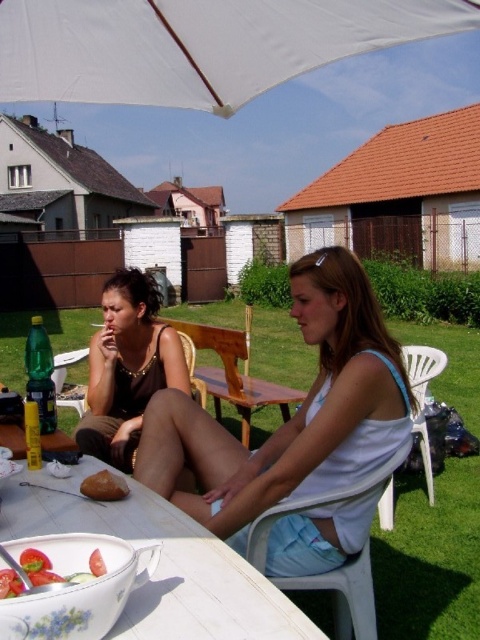
Between white fabric umbrella at upper center and tomato salad at center, which one has less height?

With less height is tomato salad at center.

Is white fabric umbrella at upper center thinner than tomato salad at center?

No.

The width and height of the screenshot is (480, 640). Identify the location of white fabric umbrella at upper center. (197, 45).

What do you see at coordinates (197, 45) in the screenshot? The width and height of the screenshot is (480, 640). I see `white fabric umbrella at upper center` at bounding box center [197, 45].

Who is shorter, white fabric umbrella at upper center or brown crumbly bread at lower left?

brown crumbly bread at lower left

Find the location of a particular element. The width and height of the screenshot is (480, 640). white fabric umbrella at upper center is located at coordinates (197, 45).

This screenshot has height=640, width=480. Identify the location of white fabric umbrella at upper center. (197, 45).

Is matte black tank top at center further to camera compared to tomato salad at center?

Yes, matte black tank top at center is further from the viewer.

Does matte black tank top at center have a lesser width compared to tomato salad at center?

In fact, matte black tank top at center might be wider than tomato salad at center.

Does point (81, 433) come behind point (93, 566)?

Yes, it is behind point (93, 566).

Identify the location of matte black tank top at center. (128, 368).